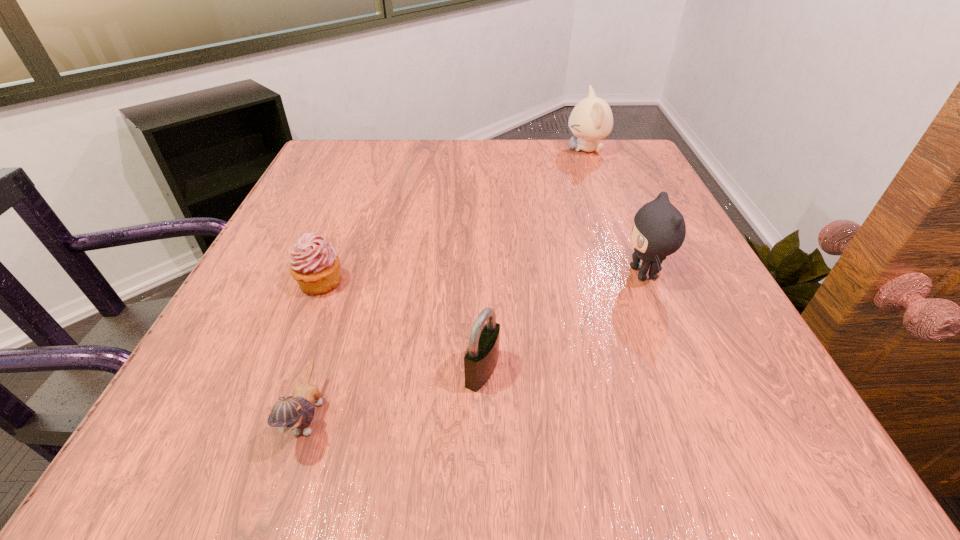
The width and height of the screenshot is (960, 540). Find the location of `free area in between the padlock and the fourth tallest object`. free area in between the padlock and the fourth tallest object is located at coordinates pyautogui.click(x=401, y=326).

Locate an element on the screen. Image resolution: width=960 pixels, height=540 pixels. unoccupied area between the farthest object and the third object from right to left is located at coordinates (535, 260).

Where is `free space between the fourth tallest object and the nearest kitten`? This screenshot has height=540, width=960. free space between the fourth tallest object and the nearest kitten is located at coordinates (315, 349).

The image size is (960, 540). I want to click on blank region between the second nearest kitten and the farthest kitten, so click(x=615, y=211).

Point out which object is positioned as the fourth nearest to the second nearest kitten. Please provide its 2D coordinates. Your answer should be formatted as a tuple, i.e. [(x, y)], where the tuple contains the x and y coordinates of a point satisfying the conditions above.

[(315, 265)]

At what (x,y) coordinates should I click in order to perform the action: click on object that is the closest to the padlock. Please return your answer as a coordinate pair (x, y). This screenshot has width=960, height=540. Looking at the image, I should click on [x=296, y=413].

Identify which kitten is the second nearest to the third object from left to right. Please provide its 2D coordinates. Your answer should be formatted as a tuple, i.e. [(x, y)], where the tuple contains the x and y coordinates of a point satisfying the conditions above.

[(659, 229)]

Where is `kitten that is the closest to the second farthest kitten`? This screenshot has height=540, width=960. kitten that is the closest to the second farthest kitten is located at coordinates (591, 119).

This screenshot has height=540, width=960. In order to click on vacant space that satisfies the following two spatial constraints: 1. on the face of the farthest kitten; 2. on the front-facing side of the leftmost kitten in this screenshot , I will do `click(690, 415)`.